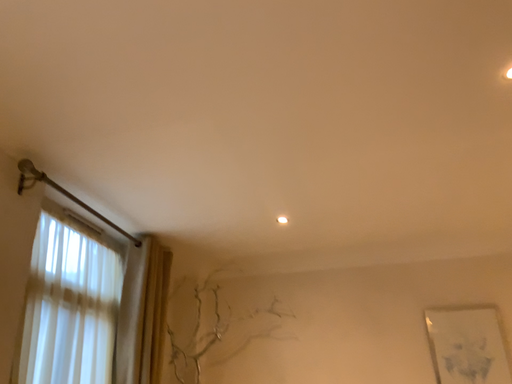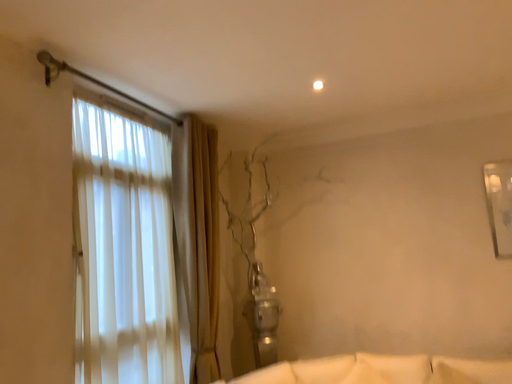
Question: How did the camera likely rotate when shooting the video?

Choices:
 (A) rotated downward
 (B) rotated upward

Answer: (A)